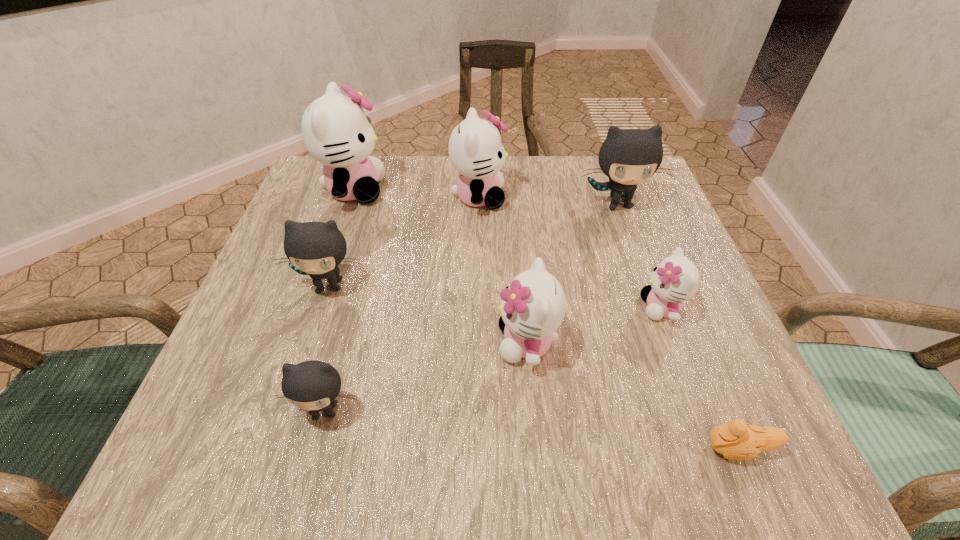
This screenshot has height=540, width=960. I want to click on the closest kitten to the third biggest white kitten, so click(675, 280).

Select which white kitten is the third closest to the leftmost white kitten. Please provide its 2D coordinates. Your answer should be formatted as a tuple, i.e. [(x, y)], where the tuple contains the x and y coordinates of a point satisfying the conditions above.

[(675, 280)]

Locate an element on the screen. white kitten that is the third closest to the second nearest gray kitten is located at coordinates 533,306.

The image size is (960, 540). I want to click on gray kitten that can be found as the third closest to the second smallest white kitten, so click(x=628, y=157).

Identify the location of gray kitten that is the closest to the second smallest gray kitten. (313, 385).

At what (x,y) coordinates should I click in order to perform the action: click on vacant area in the image that satisfies the following two spatial constraints: 1. on the front-facing side of the smallest white kitten; 2. on the front-facing side of the seventh farthest object. Please return your answer as a coordinate pair (x, y). This screenshot has height=540, width=960. Looking at the image, I should click on (700, 410).

Where is `free space in the image that satisfies the following two spatial constraints: 1. on the front-facing side of the third smallest white kitten; 2. on the front-facing side of the nearest kitten`? This screenshot has width=960, height=540. free space in the image that satisfies the following two spatial constraints: 1. on the front-facing side of the third smallest white kitten; 2. on the front-facing side of the nearest kitten is located at coordinates (478, 410).